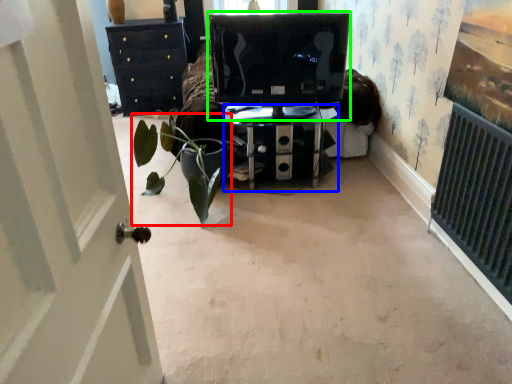
Question: Considering the real-world distances, which object is closest to houseplant (highlighted by a red box)? furniture (highlighted by a blue box) or computer monitor (highlighted by a green box).

Choices:
 (A) furniture
 (B) computer monitor

Answer: (A)